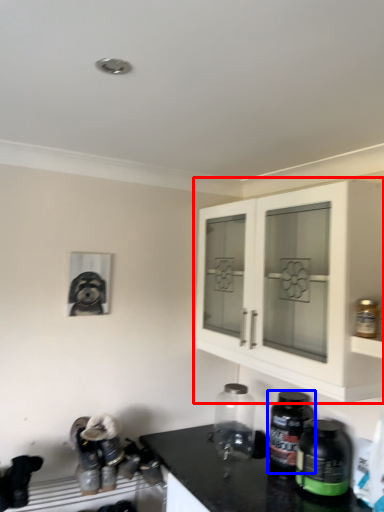
Question: Which point is further to the camera, cabinetry (highlighted by a red box) or bottle (highlighted by a blue box)?

Choices:
 (A) cabinetry
 (B) bottle

Answer: (B)